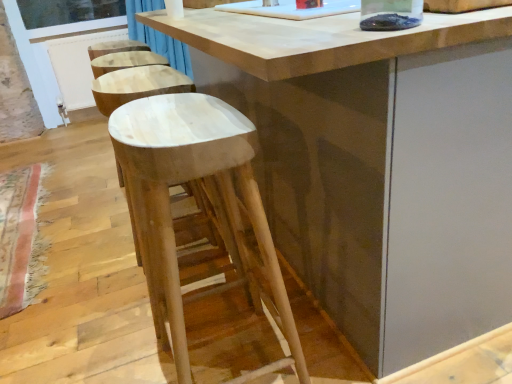
Question: Is point (121, 153) closer or farther from the camera than point (76, 14)?

Choices:
 (A) closer
 (B) farther

Answer: (A)

Question: In terms of height, does natural wood stool at center look taller or shorter compared to clear glass window screen at upper left?

Choices:
 (A) tall
 (B) short

Answer: (A)

Question: Based on their relative distances, which object is farther from the natural wood stool at center?

Choices:
 (A) natural wood table at center
 (B) clear glass window screen at upper left
 (C) white plastic screen door at left

Answer: (B)

Question: Which is farther from the natural wood table at center?

Choices:
 (A) clear glass window screen at upper left
 (B) white plastic screen door at left
 (C) natural wood stool at center

Answer: (A)